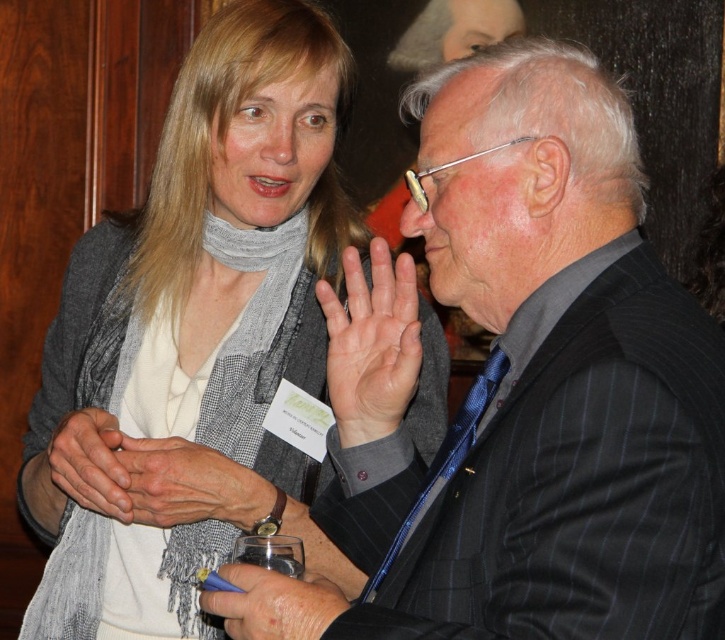
You are at a formal event and need to take a photo of both the woman on the left and the man on the right. The photographer tells you that the two points in the image, point [505,164] and point [152,474], determine the best focus distance. Which point should you focus on to ensure both subjects are in focus?

You should focus on point [505,164] because it is closer to the camera than point [152,474], ensuring both subjects are in focus.

You are a photographer at a formal event. You need to capture a clear photo of the name tag on the matte gray scarf at center without the smooth skin hand at center blocking it. Is the scarf positioned above or below the hand?

The matte gray scarf at center is much taller than the smooth skin hand at center, so the scarf is positioned above the hand. This means you can capture the name tag clearly without obstruction.

You are organizing a charity event and need to place a decorative pillow on a chair. The chair has a seat that can only accommodate items up to the size of the smooth beige scarf at center. Can the matte black suit at center be placed on the chair without exceeding the size limit?

The matte black suit at center is larger in size than the smooth beige scarf at center, so it cannot be placed on the chair without exceeding the size limit.